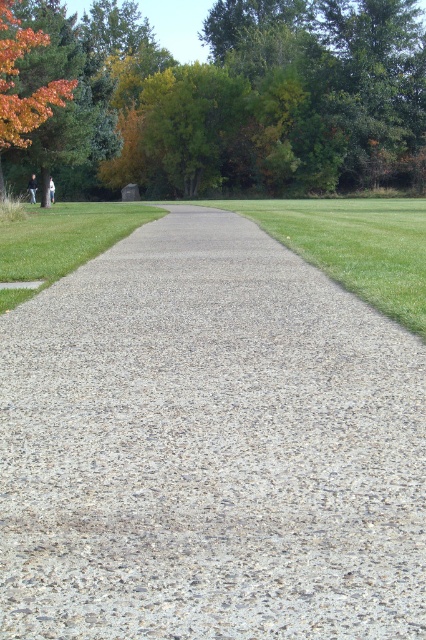
Question: Is green grass at center above orange leafy tree at upper left?

Choices:
 (A) no
 (B) yes

Answer: (A)

Question: Is gray gravel at center above green leafy tree at upper center?

Choices:
 (A) no
 (B) yes

Answer: (A)

Question: Which object is farther from the camera taking this photo?

Choices:
 (A) green leafy tree at upper center
 (B) gray gravel at center
 (C) green grass at center
 (D) orange leafy tree at upper left

Answer: (A)

Question: Does gray gravel at center appear on the left side of orange leafy tree at upper left?

Choices:
 (A) yes
 (B) no

Answer: (B)

Question: Which point appears farthest from the camera in this image?

Choices:
 (A) (x=13, y=67)
 (B) (x=245, y=148)
 (C) (x=408, y=284)

Answer: (B)

Question: Which object is closer to the camera taking this photo?

Choices:
 (A) orange leafy tree at upper left
 (B) gray gravel at center

Answer: (B)